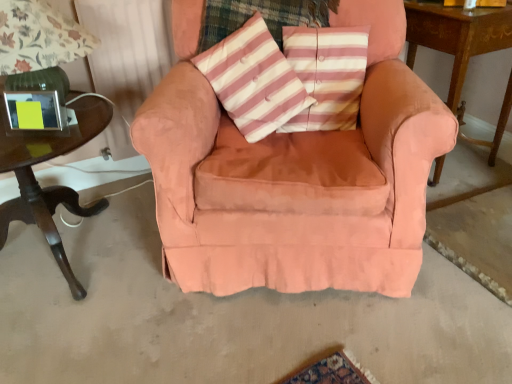
Question: Should I look upward or downward to see dark wood table at left, positioned as the first table in left-to-right order?

Choices:
 (A) up
 (B) down

Answer: (A)

Question: From a real-world perspective, is green glass table lamp at left positioned under suede-like peach armchair at center based on gravity?

Choices:
 (A) no
 (B) yes

Answer: (A)

Question: Can you confirm if green glass table lamp at left is wider than suede-like peach armchair at center?

Choices:
 (A) no
 (B) yes

Answer: (A)

Question: Is green glass table lamp at left at the right side of suede-like peach armchair at center?

Choices:
 (A) no
 (B) yes

Answer: (A)

Question: Are green glass table lamp at left and suede-like peach armchair at center beside each other?

Choices:
 (A) yes
 (B) no

Answer: (B)

Question: Is there a large distance between green glass table lamp at left and suede-like peach armchair at center?

Choices:
 (A) no
 (B) yes

Answer: (A)

Question: Is green glass table lamp at left positioned behind suede-like peach armchair at center?

Choices:
 (A) yes
 (B) no

Answer: (A)

Question: Is dark wood table at left, positioned as the first table in left-to-right order, thinner than pink striped cushion at center?

Choices:
 (A) yes
 (B) no

Answer: (B)

Question: Is dark wood table at left, positioned as the first table in left-to-right order, looking in the opposite direction of pink striped cushion at center?

Choices:
 (A) yes
 (B) no

Answer: (B)

Question: Is dark wood table at left, positioned as the first table in left-to-right order, wider than pink striped cushion at center?

Choices:
 (A) no
 (B) yes

Answer: (B)

Question: From a real-world perspective, is dark wood table at left, positioned as the first table in left-to-right order, physically below pink striped cushion at center?

Choices:
 (A) yes
 (B) no

Answer: (A)

Question: Is dark wood table at left, positioned as the second table in right-to-left order, closer to the viewer compared to pink striped cushion at center?

Choices:
 (A) yes
 (B) no

Answer: (A)

Question: Considering the relative positions of dark wood table at left, positioned as the first table in left-to-right order, and pink striped cushion at center in the image provided, is dark wood table at left, positioned as the first table in left-to-right order, behind pink striped cushion at center?

Choices:
 (A) yes
 (B) no

Answer: (B)

Question: From the image's perspective, is pink striped cushion at center on dark wood table at left, positioned as the second table in right-to-left order?

Choices:
 (A) yes
 (B) no

Answer: (A)